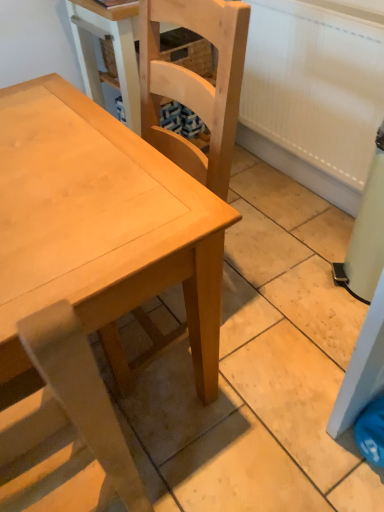
Question: From the image's perspective, is light brown wood chair at center, which is counted as the 2th chair, starting from the top, on top of natural wood chair at center, which appears as the second chair when ordered from the bottom?

Choices:
 (A) no
 (B) yes

Answer: (A)

Question: Is the position of light brown wood chair at center, which is the first chair in bottom-to-top order, more distant than that of natural wood chair at center, the first chair viewed from the top?

Choices:
 (A) yes
 (B) no

Answer: (B)

Question: From the image's perspective, is light brown wood chair at center, which is counted as the 2th chair, starting from the top, under natural wood chair at center, the first chair viewed from the top?

Choices:
 (A) no
 (B) yes

Answer: (B)

Question: Does light brown wood chair at center, which is the first chair in bottom-to-top order, have a lesser width compared to natural wood chair at center, the first chair viewed from the top?

Choices:
 (A) yes
 (B) no

Answer: (A)

Question: Can you confirm if light brown wood chair at center, which is the first chair in bottom-to-top order, is taller than natural wood chair at center, the first chair viewed from the top?

Choices:
 (A) yes
 (B) no

Answer: (A)

Question: Is light brown wood chair at center, which is the first chair in bottom-to-top order, taller or shorter than light wood table at center?

Choices:
 (A) tall
 (B) short

Answer: (A)

Question: Based on their sizes in the image, would you say light brown wood chair at center, which is counted as the 2th chair, starting from the top, is bigger or smaller than light wood table at center?

Choices:
 (A) small
 (B) big

Answer: (A)

Question: Considering their positions, is light brown wood chair at center, which is the first chair in bottom-to-top order, located in front of or behind light wood table at center?

Choices:
 (A) front
 (B) behind

Answer: (A)

Question: Is point (115, 466) closer or farther from the camera than point (36, 154)?

Choices:
 (A) farther
 (B) closer

Answer: (B)

Question: Is point (243, 16) positioned closer to the camera than point (150, 232)?

Choices:
 (A) farther
 (B) closer

Answer: (A)

Question: Considering the positions of natural wood chair at center, which appears as the second chair when ordered from the bottom, and light wood table at center in the image, is natural wood chair at center, which appears as the second chair when ordered from the bottom, taller or shorter than light wood table at center?

Choices:
 (A) tall
 (B) short

Answer: (A)

Question: From a real-world perspective, is natural wood chair at center, the first chair viewed from the top, physically located above or below light wood table at center?

Choices:
 (A) above
 (B) below

Answer: (A)

Question: Would you say natural wood chair at center, which appears as the second chair when ordered from the bottom, is to the left or to the right of light wood table at center in the picture?

Choices:
 (A) right
 (B) left

Answer: (A)

Question: From the image's perspective, is natural wood chair at center, the first chair viewed from the top, above or below light brown wood chair at center, which is counted as the 2th chair, starting from the top?

Choices:
 (A) above
 (B) below

Answer: (A)

Question: In terms of width, does natural wood chair at center, which appears as the second chair when ordered from the bottom, look wider or thinner when compared to light brown wood chair at center, which is counted as the 2th chair, starting from the top?

Choices:
 (A) wide
 (B) thin

Answer: (A)